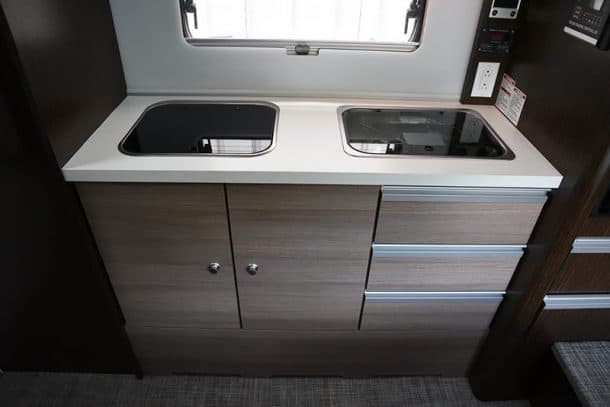
I want to click on steel handle, so click(440, 201).